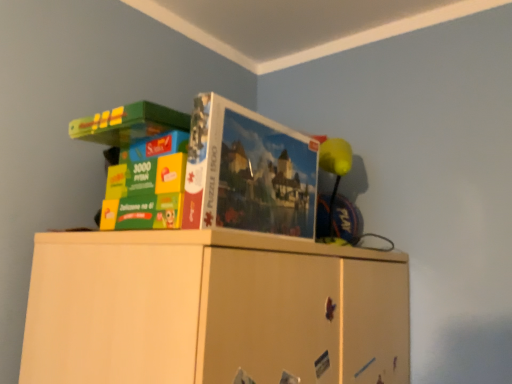
The height and width of the screenshot is (384, 512). I want to click on blue cardboard puzzle at upper center, so click(x=248, y=172).

Describe the element at coordinates (248, 172) in the screenshot. I see `blue cardboard puzzle at upper center` at that location.

I want to click on blue cardboard puzzle at upper center, so click(248, 172).